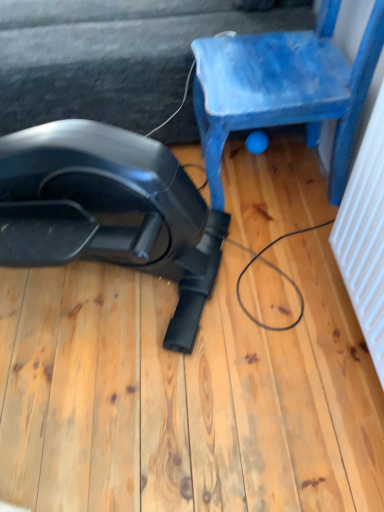
Question: Is black plastic vacuum cleaner at lower left surrounded by black rubber vacuum cleaner at lower left?

Choices:
 (A) yes
 (B) no

Answer: (B)

Question: Is black plastic vacuum cleaner at lower left at the back of black rubber vacuum cleaner at lower left?

Choices:
 (A) yes
 (B) no

Answer: (B)

Question: Can you confirm if black rubber vacuum cleaner at lower left is bigger than black plastic vacuum cleaner at lower left?

Choices:
 (A) no
 (B) yes

Answer: (A)

Question: From the image's perspective, does black rubber vacuum cleaner at lower left appear higher than black plastic vacuum cleaner at lower left?

Choices:
 (A) no
 (B) yes

Answer: (A)

Question: Does black rubber vacuum cleaner at lower left appear on the left side of black plastic vacuum cleaner at lower left?

Choices:
 (A) yes
 (B) no

Answer: (A)

Question: From a real-world perspective, is black rubber vacuum cleaner at lower left positioned above or below black plastic vacuum cleaner at lower left?

Choices:
 (A) below
 (B) above

Answer: (B)

Question: Is black rubber vacuum cleaner at lower left spatially inside black plastic vacuum cleaner at lower left, or outside of it?

Choices:
 (A) outside
 (B) inside

Answer: (A)

Question: From the image's perspective, is black rubber vacuum cleaner at lower left positioned above or below black plastic vacuum cleaner at lower left?

Choices:
 (A) above
 (B) below

Answer: (B)

Question: Is black rubber vacuum cleaner at lower left taller or shorter than black plastic vacuum cleaner at lower left?

Choices:
 (A) tall
 (B) short

Answer: (A)

Question: From the image's perspective, relative to black plastic vacuum cleaner at lower left, is blue painted wood chair at upper right above or below?

Choices:
 (A) below
 (B) above

Answer: (A)

Question: Considering their positions, is blue painted wood chair at upper right located in front of or behind black plastic vacuum cleaner at lower left?

Choices:
 (A) front
 (B) behind

Answer: (A)

Question: Considering the positions of point click(x=329, y=10) and point click(x=69, y=75), is point click(x=329, y=10) closer or farther from the camera than point click(x=69, y=75)?

Choices:
 (A) farther
 (B) closer

Answer: (B)

Question: In terms of size, does blue painted wood chair at upper right appear bigger or smaller than black plastic vacuum cleaner at lower left?

Choices:
 (A) small
 (B) big

Answer: (A)

Question: Relative to black rubber vacuum cleaner at lower left, is blue painted wood chair at upper right in front or behind?

Choices:
 (A) behind
 (B) front

Answer: (A)

Question: Considering the positions of blue painted wood chair at upper right and black rubber vacuum cleaner at lower left in the image, is blue painted wood chair at upper right wider or thinner than black rubber vacuum cleaner at lower left?

Choices:
 (A) thin
 (B) wide

Answer: (A)